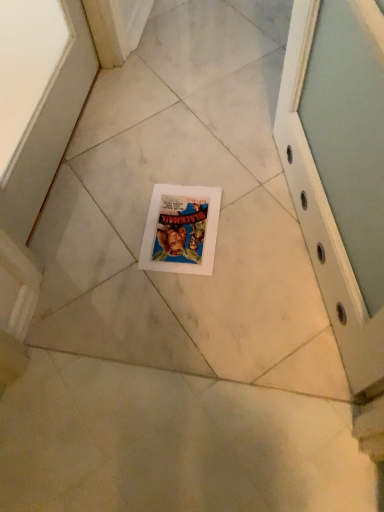
Question: Should I look upward or downward to see white paper comic book at center?

Choices:
 (A) up
 (B) down

Answer: (A)